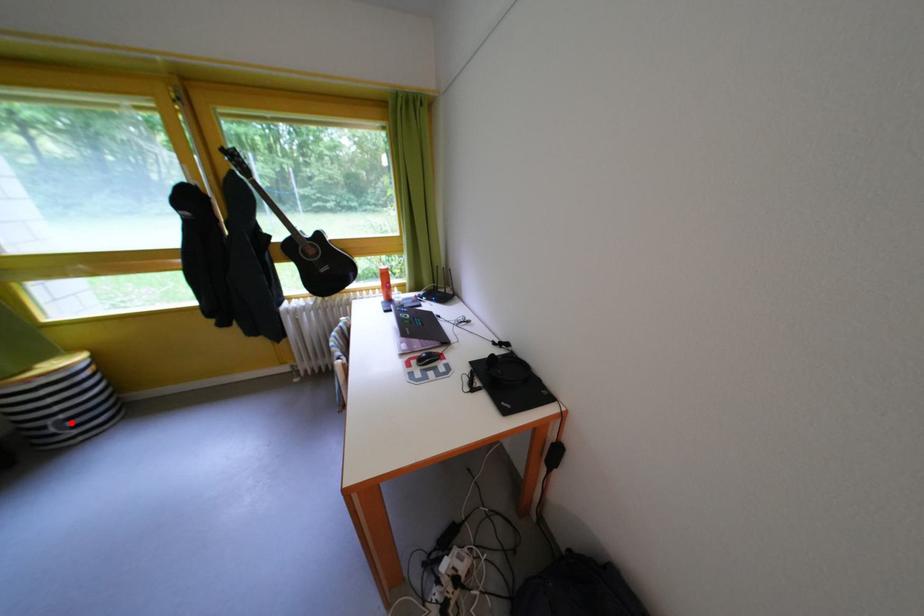
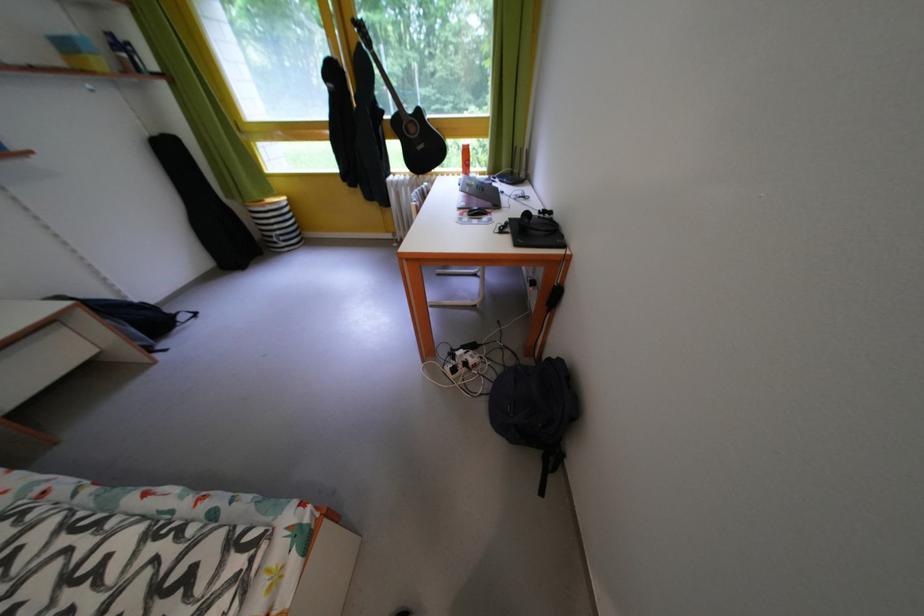
Locate, in the second image, the point that corresponds to the highlighted location in the first image.

(287, 238)